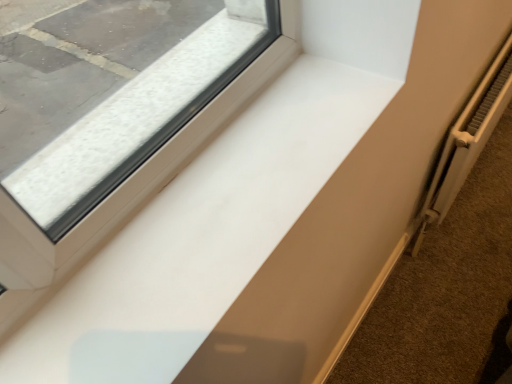
Question: Does white glossy window sill at center have a smaller size compared to white metallic radiator at right?

Choices:
 (A) no
 (B) yes

Answer: (B)

Question: Are white glossy window sill at center and white metallic radiator at right beside each other?

Choices:
 (A) yes
 (B) no

Answer: (B)

Question: Considering the relative sizes of white glossy window sill at center and white metallic radiator at right in the image provided, is white glossy window sill at center shorter than white metallic radiator at right?

Choices:
 (A) no
 (B) yes

Answer: (B)

Question: Is white glossy window sill at center positioned with its back to white metallic radiator at right?

Choices:
 (A) yes
 (B) no

Answer: (B)

Question: Could you tell me if white glossy window sill at center is turned towards white metallic radiator at right?

Choices:
 (A) no
 (B) yes

Answer: (A)

Question: Is white glossy window sill at center positioned before white metallic radiator at right?

Choices:
 (A) no
 (B) yes

Answer: (B)

Question: Is white glossy window sill at center to the right of white matte radiator at lower right from the viewer's perspective?

Choices:
 (A) yes
 (B) no

Answer: (B)

Question: Is white matte radiator at lower right completely or partially inside white glossy window sill at center?

Choices:
 (A) yes
 (B) no

Answer: (B)

Question: Is white glossy window sill at center with white matte radiator at lower right?

Choices:
 (A) yes
 (B) no

Answer: (B)

Question: Is the position of white glossy window sill at center more distant than that of white matte radiator at lower right?

Choices:
 (A) yes
 (B) no

Answer: (B)

Question: Is white glossy window sill at center not near white matte radiator at lower right?

Choices:
 (A) no
 (B) yes

Answer: (B)

Question: Considering the relative positions of white glossy window sill at center and white matte radiator at lower right in the image provided, is white glossy window sill at center to the left of white matte radiator at lower right from the viewer's perspective?

Choices:
 (A) no
 (B) yes

Answer: (B)

Question: Considering the relative positions of white matte radiator at lower right and white metallic radiator at right in the image provided, is white matte radiator at lower right in front of white metallic radiator at right?

Choices:
 (A) no
 (B) yes

Answer: (A)